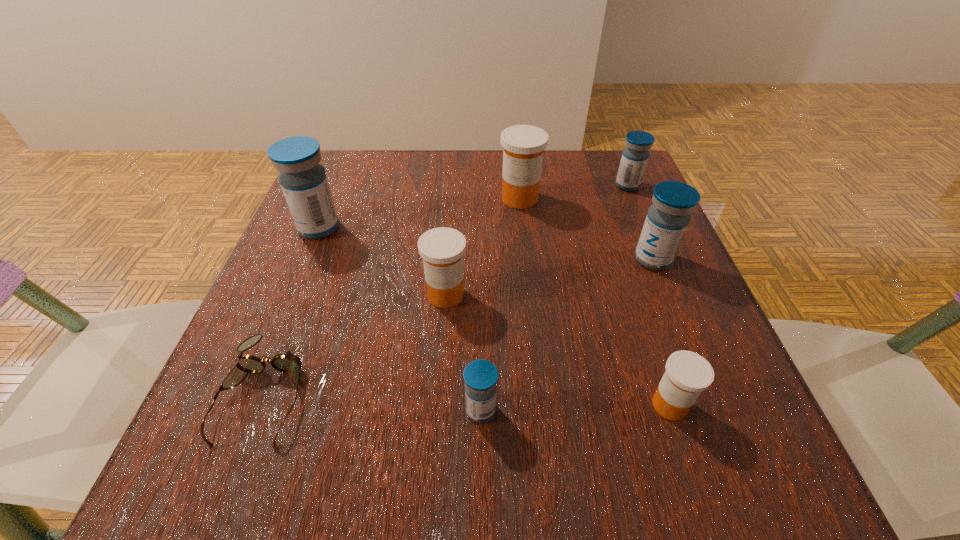
Image resolution: width=960 pixels, height=540 pixels. I want to click on vacant area situated on the label of the smallest orange medicine, so click(x=522, y=405).

Where is `vacant space located 0.330m on the label of the smallest orange medicine`? Image resolution: width=960 pixels, height=540 pixels. vacant space located 0.330m on the label of the smallest orange medicine is located at coordinates click(x=416, y=405).

Where is `vacant space located on the label of the smallest orange medicine`? Image resolution: width=960 pixels, height=540 pixels. vacant space located on the label of the smallest orange medicine is located at coordinates coord(543,405).

The width and height of the screenshot is (960, 540). Find the location of `object that is at the near edge`. object that is at the near edge is located at coordinates (288, 363).

You are a GUI agent. You are given a task and a screenshot of the screen. Output one action in this format:
    pyautogui.click(x=<x>, y=<y>)
    Task: Click on the medicine located in the left edge section of the desktop
    
    Given the screenshot: What is the action you would take?
    pyautogui.click(x=303, y=180)

You are a GUI agent. You are given a task and a screenshot of the screen. Output one action in this format:
    pyautogui.click(x=<x>, y=<y>)
    Task: Click on the spectacles at the left edge
    
    Given the screenshot: What is the action you would take?
    pyautogui.click(x=288, y=363)

The image size is (960, 540). Find the location of `object that is at the near left corner`. object that is at the near left corner is located at coordinates (288, 363).

Where is `object present at the far right corner`? The width and height of the screenshot is (960, 540). object present at the far right corner is located at coordinates (635, 155).

The height and width of the screenshot is (540, 960). I want to click on blank space at the far edge, so click(x=393, y=178).

Where is `vacant space at the left edge of the desktop`? The height and width of the screenshot is (540, 960). vacant space at the left edge of the desktop is located at coordinates (366, 258).